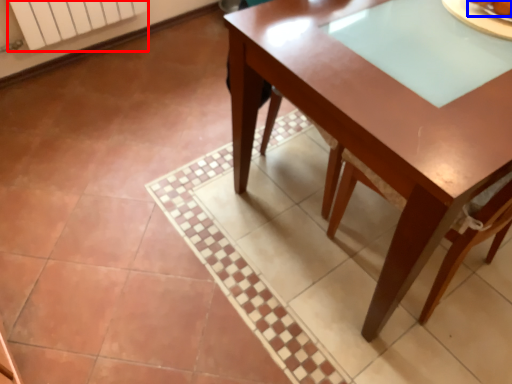
Question: Which of the following is the farthest to the observer, radiator (highlighted by a red box) or food (highlighted by a blue box)?

Choices:
 (A) radiator
 (B) food

Answer: (A)